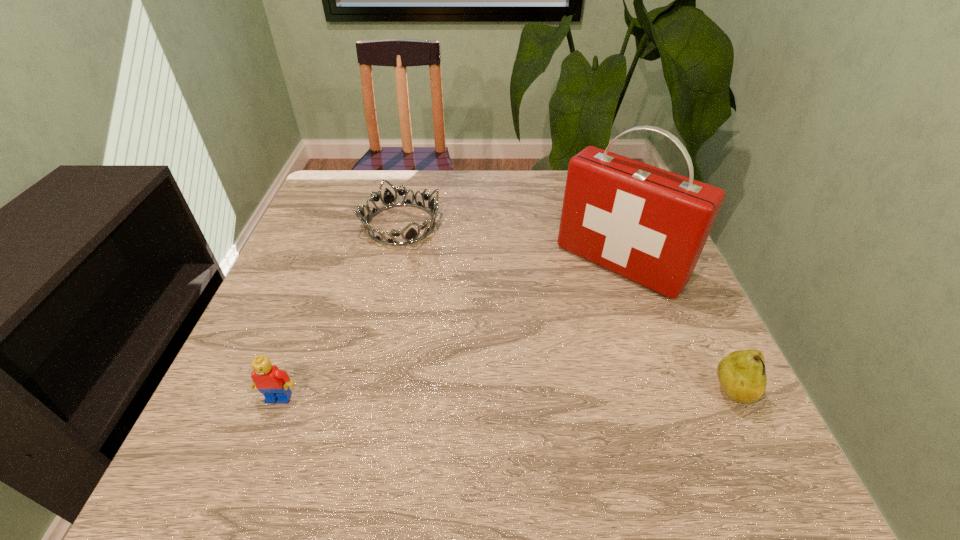
Where is `the leftmost object`? This screenshot has height=540, width=960. the leftmost object is located at coordinates (273, 383).

Identify the location of pear. (742, 374).

The height and width of the screenshot is (540, 960). Find the location of `the tallest object`. the tallest object is located at coordinates (649, 225).

Find the location of a particular element. The width and height of the screenshot is (960, 540). the shortest object is located at coordinates (411, 236).

You are a GUI agent. You are given a task and a screenshot of the screen. Output one action in this format:
    pyautogui.click(x=<x>, y=<y>)
    Task: Click on the second object from left to right
    
    Given the screenshot: What is the action you would take?
    pyautogui.click(x=411, y=236)

You are a GUI agent. You are given a task and a screenshot of the screen. Output one action in this format:
    pyautogui.click(x=<x>, y=<y>)
    Task: Click on the free location located 0.140m on the back of the pear
    This screenshot has width=960, height=540.
    Given the screenshot: What is the action you would take?
    [x=696, y=316]

You are a GUI agent. You are given a task and a screenshot of the screen. Output one action in this format:
    pyautogui.click(x=<x>, y=<y>)
    Task: Click on the blank space located 0.220m on the front face of the tallest object
    
    Given the screenshot: What is the action you would take?
    pyautogui.click(x=533, y=356)

The height and width of the screenshot is (540, 960). I want to click on free region located on the front face of the tallest object, so click(530, 359).

Identify the location of vacant space located 0.390m on the front face of the tallest object. This screenshot has width=960, height=540. (476, 418).

The width and height of the screenshot is (960, 540). Identify the location of blank area located 0.120m on the front-facing side of the third object from right to left. (432, 276).